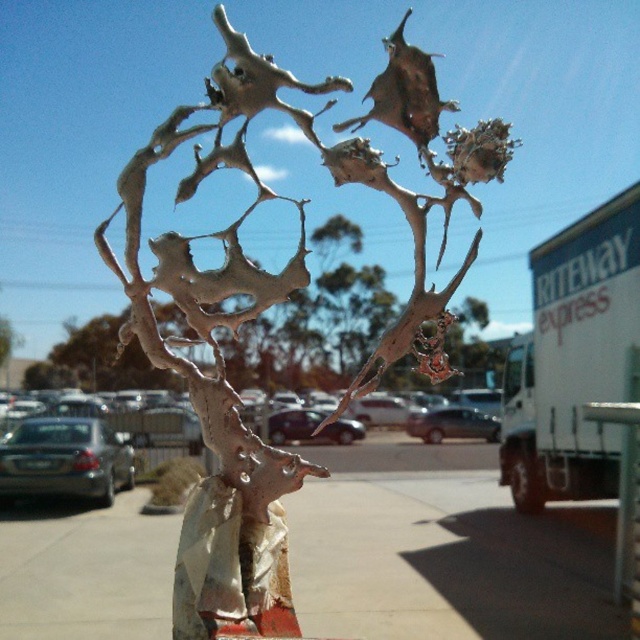
Question: Which point is closer to the camera taking this photo?

Choices:
 (A) (253, 202)
 (B) (464, 545)

Answer: (A)

Question: Where is matte silver sculpture at center located in relation to smooth concrete sidewalk at center in the image?

Choices:
 (A) left
 (B) right

Answer: (A)

Question: Is matte silver sculpture at center positioned before smooth concrete sidewalk at center?

Choices:
 (A) no
 (B) yes

Answer: (B)

Question: Can you confirm if matte silver sculpture at center is wider than smooth concrete sidewalk at center?

Choices:
 (A) yes
 (B) no

Answer: (B)